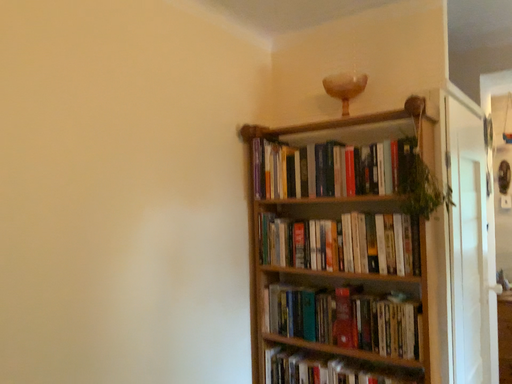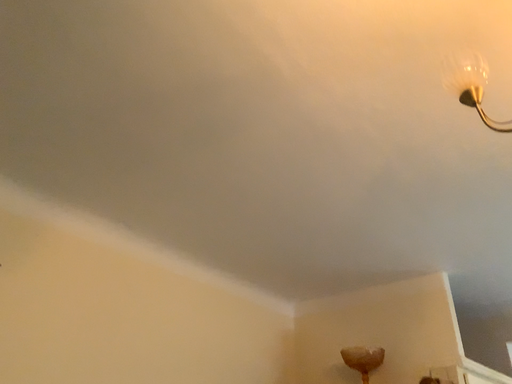
Question: How did the camera likely rotate when shooting the video?

Choices:
 (A) rotated upward
 (B) rotated downward

Answer: (A)